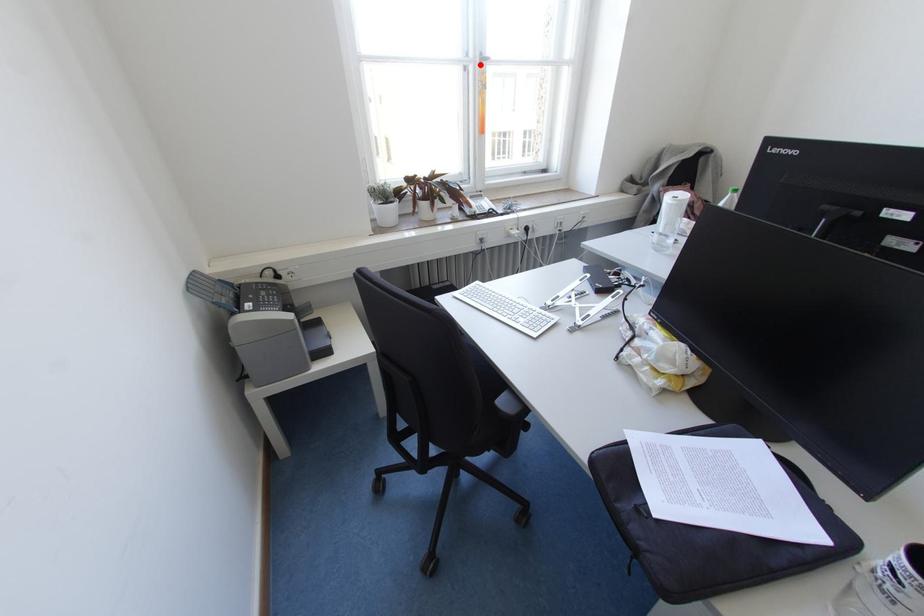
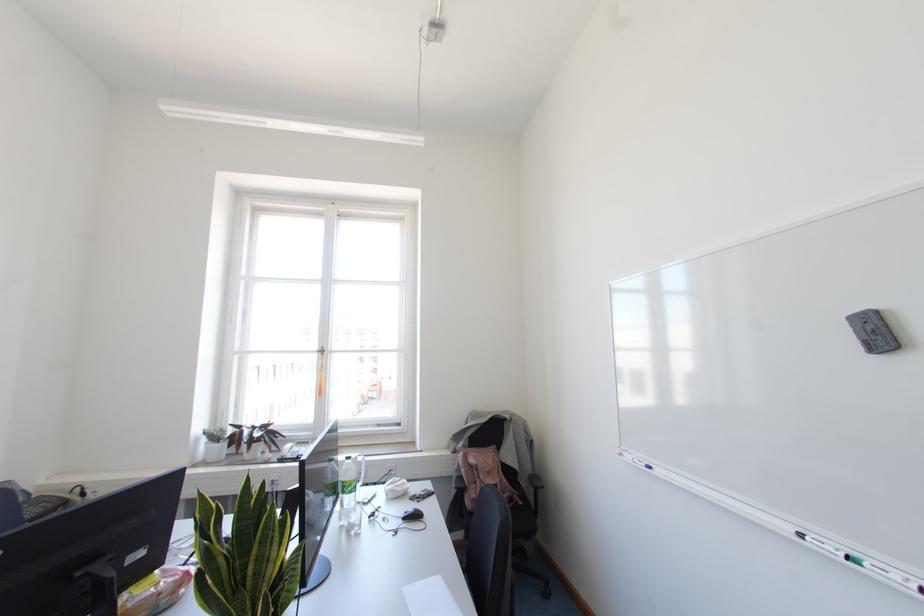
Question: I am providing you with two images of the same scene from different viewpoints. In image1, a red point is highlighted. Considering the same 3D point in image2, which of the following is correct?

Choices:
 (A) It is closer
 (B) It is farther

Answer: (B)